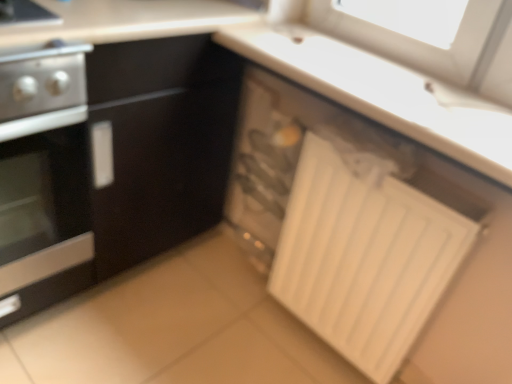
Question: Is white matte radiator at lower right completely or partially outside of stainless steel oven at left?

Choices:
 (A) yes
 (B) no

Answer: (A)

Question: Can stainless steel oven at left be found inside white matte radiator at lower right?

Choices:
 (A) yes
 (B) no

Answer: (B)

Question: Considering the relative sizes of white matte radiator at lower right and stainless steel oven at left in the image provided, is white matte radiator at lower right thinner than stainless steel oven at left?

Choices:
 (A) no
 (B) yes

Answer: (B)

Question: Considering the relative positions of white matte radiator at lower right and stainless steel oven at left in the image provided, is white matte radiator at lower right to the right of stainless steel oven at left from the viewer's perspective?

Choices:
 (A) yes
 (B) no

Answer: (A)

Question: Are white matte radiator at lower right and stainless steel oven at left located far from each other?

Choices:
 (A) no
 (B) yes

Answer: (A)

Question: Would you say white plastic drawer at lower right is to the left or to the right of white matte radiator at lower right in the picture?

Choices:
 (A) left
 (B) right

Answer: (A)

Question: Does point (232, 228) appear closer or farther from the camera than point (408, 344)?

Choices:
 (A) closer
 (B) farther

Answer: (B)

Question: Considering the positions of white plastic drawer at lower right and white matte radiator at lower right in the image, is white plastic drawer at lower right taller or shorter than white matte radiator at lower right?

Choices:
 (A) tall
 (B) short

Answer: (B)

Question: Considering their positions, is white plastic drawer at lower right located in front of or behind white matte radiator at lower right?

Choices:
 (A) behind
 (B) front

Answer: (A)

Question: Considering the positions of white plastic drawer at lower right and stainless steel oven at left in the image, is white plastic drawer at lower right taller or shorter than stainless steel oven at left?

Choices:
 (A) short
 (B) tall

Answer: (A)

Question: In the image, is white plastic drawer at lower right positioned in front of or behind stainless steel oven at left?

Choices:
 (A) behind
 (B) front

Answer: (A)

Question: Considering the positions of white plastic drawer at lower right and stainless steel oven at left in the image, is white plastic drawer at lower right bigger or smaller than stainless steel oven at left?

Choices:
 (A) big
 (B) small

Answer: (B)

Question: Looking at their shapes, would you say white plastic drawer at lower right is wider or thinner than stainless steel oven at left?

Choices:
 (A) thin
 (B) wide

Answer: (A)

Question: Considering their positions, is stainless steel oven at left located in front of or behind white plastic drawer at lower right?

Choices:
 (A) behind
 (B) front

Answer: (B)

Question: Based on their positions, is stainless steel oven at left located to the left or right of white plastic drawer at lower right?

Choices:
 (A) left
 (B) right

Answer: (A)